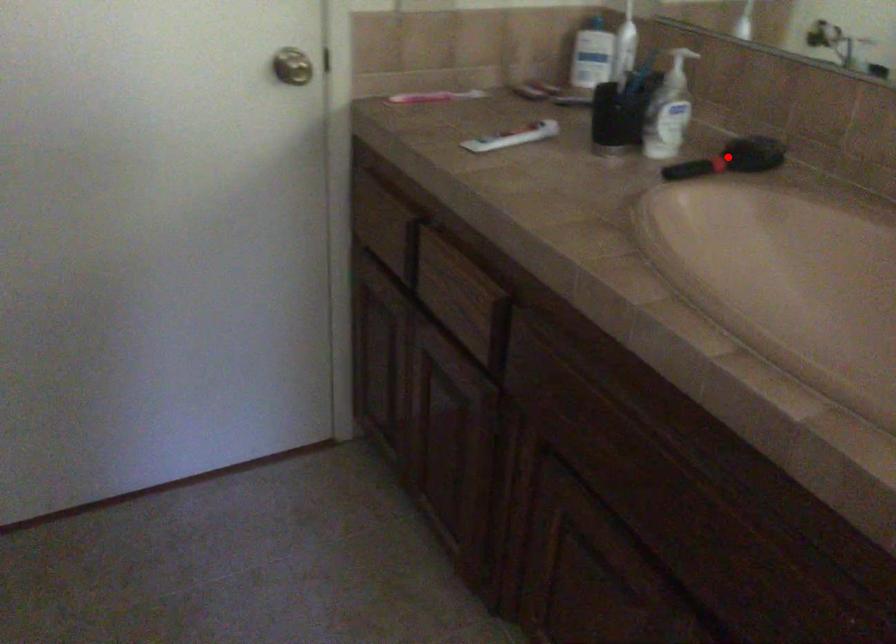
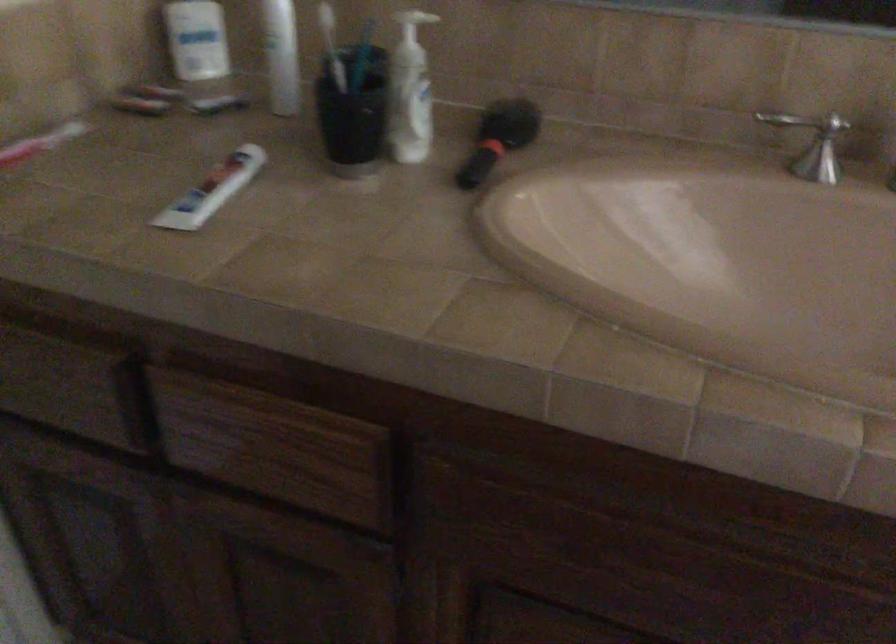
Where in the second image is the point corresponding to the highlighted location from the first image?

(498, 138)